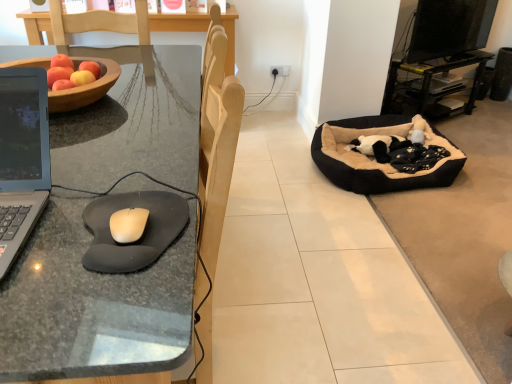
This screenshot has width=512, height=384. Describe the element at coordinates (443, 45) in the screenshot. I see `black plastic entertainment center at right` at that location.

You are a GUI agent. You are given a task and a screenshot of the screen. Output one action in this format:
    pyautogui.click(x=<x>, y=<y>)
    Task: Click on the white matte mouse at left
    
    Given the screenshot: What is the action you would take?
    pyautogui.click(x=128, y=224)

What do you see at coordinates (142, 234) in the screenshot? Image resolution: width=512 pixels, height=384 pixels. I see `black foam mousepad at left` at bounding box center [142, 234].

Where is `black foam mousepad at left`? The width and height of the screenshot is (512, 384). black foam mousepad at left is located at coordinates (142, 234).

This screenshot has width=512, height=384. Describe the element at coordinates (22, 157) in the screenshot. I see `silver metallic laptop at left` at that location.

Find the location of a particular element. Image resolution: width=512 pixels, height=384 pixels. black plastic entertainment center at right is located at coordinates (443, 45).

From a real-world perspective, between black foam mousepad at left and black glossy tv at upper right, who is vertically lower?

From a 3D spatial view, black glossy tv at upper right is below.

Is black foam mousepad at left not close to black glossy tv at upper right?

Absolutely, black foam mousepad at left is distant from black glossy tv at upper right.

Does black foam mousepad at left have a larger size compared to black glossy tv at upper right?

No, black foam mousepad at left is not bigger than black glossy tv at upper right.

How far apart are black foam mousepad at left and black glossy tv at upper right?

black foam mousepad at left and black glossy tv at upper right are 3.15 meters apart from each other.

From the image's perspective, relative to black fabric speaker at upper right, is wooden bowl at left above or below?

Clearly, from the image's perspective, wooden bowl at left is below black fabric speaker at upper right.

Which object is wider, wooden bowl at left or black fabric speaker at upper right?

With larger width is wooden bowl at left.

Image resolution: width=512 pixels, height=384 pixels. There is a black fabric speaker at upper right. In order to click on bowl above it (from a real-world perspective) in this screenshot , I will do `click(85, 87)`.

Does wooden bowl at left have a larger size compared to black fabric speaker at upper right?

Yes, wooden bowl at left is bigger than black fabric speaker at upper right.

Is black glossy tv at upper right not within black foam mousepad at left?

Yes.

From the image's perspective, between black glossy tv at upper right and black foam mousepad at left, which one is located above?

black glossy tv at upper right is shown above in the image.

Is black glossy tv at upper right beside black foam mousepad at left?

They are not placed beside each other.

Which object is positioned more to the right, black glossy tv at upper right or black foam mousepad at left?

black glossy tv at upper right.

Which of these two, wooden bowl at left or black glossy tv at upper right, is wider?

wooden bowl at left is wider.

Would you say wooden bowl at left is a long distance from black glossy tv at upper right?

Indeed, wooden bowl at left is not near black glossy tv at upper right.

Can we say wooden bowl at left lies outside black glossy tv at upper right?

Yes, wooden bowl at left is outside of black glossy tv at upper right.

From the image's perspective, is wooden bowl at left beneath black glossy tv at upper right?

Yes.

Does black rubber mouse pad at left have a larger size compared to wooden bowl at left?

Yes, black rubber mouse pad at left is bigger than wooden bowl at left.

In terms of width, does black rubber mouse pad at left look wider or thinner when compared to wooden bowl at left?

black rubber mouse pad at left is wider than wooden bowl at left.

Considering the positions of points (142, 81) and (87, 94), is point (142, 81) farther from camera compared to point (87, 94)?

Yes, it is.

Which of these two, black foam mousepad at left or black fabric speaker at upper right, is thinner?

With smaller width is black fabric speaker at upper right.

Is black foam mousepad at left surrounding black fabric speaker at upper right?

No.

Does black foam mousepad at left appear on the right side of black fabric speaker at upper right?

In fact, black foam mousepad at left is to the left of black fabric speaker at upper right.

Considering the sizes of objects black foam mousepad at left and black fabric speaker at upper right in the image provided, who is smaller, black foam mousepad at left or black fabric speaker at upper right?

Smaller between the two is black foam mousepad at left.

Can you tell me how much wooden bowl at left and black plush dog bed at right differ in facing direction?

The facing directions of wooden bowl at left and black plush dog bed at right are 92.3 degrees apart.

From the picture: Could you tell me if wooden bowl at left is turned towards black plush dog bed at right?

No, wooden bowl at left is not facing towards black plush dog bed at right.

From a real-world perspective, does wooden bowl at left sit lower than black plush dog bed at right?

Incorrect, from a real-world perspective, wooden bowl at left is higher than black plush dog bed at right.

This screenshot has width=512, height=384. What are the coordinates of `mousepad on the left of the black glossy tv at upper right` in the screenshot? It's located at (142, 234).

Identify the location of bowl located below the black fabric speaker at upper right (from the image's perspective). This screenshot has height=384, width=512. (85, 87).

From the image, which object appears to be nearer to black rubber mouse pad at left, silver metallic laptop at left or black plush dog bed at right?

silver metallic laptop at left.

When comparing their distances from black fabric speaker at upper right, does black plush dog bed at right or black foam mousepad at left seem further?

Based on the image, black foam mousepad at left appears to be further to black fabric speaker at upper right.

Looking at the image, which one is located further to black glossy tv at upper right, black rubber mouse pad at left or black plush dog bed at right?

The object further to black glossy tv at upper right is black rubber mouse pad at left.

Based on the photo, looking at the image, which one is located closer to white matte mouse at left, black plush dog bed at right or silver metallic laptop at left?

silver metallic laptop at left is closer to white matte mouse at left.

Which object lies nearer to the anchor point black fabric speaker at upper right, black rubber mouse pad at left or black plastic entertainment center at right?

Among the two, black plastic entertainment center at right is located nearer to black fabric speaker at upper right.

Which object lies nearer to the anchor point black plastic entertainment center at right, black foam mousepad at left or wooden bowl at left?

Based on the image, wooden bowl at left appears to be nearer to black plastic entertainment center at right.

Considering their positions, is wooden bowl at left positioned further to black fabric speaker at upper right than black foam mousepad at left?

black foam mousepad at left is positioned further to the anchor black fabric speaker at upper right.

From the image, which object appears to be farther from black fabric speaker at upper right, black plush dog bed at right or silver metallic laptop at left?

Among the two, silver metallic laptop at left is located further to black fabric speaker at upper right.

Where is `dog bed between white matte mouse at left and black plastic entertainment center at right from front to back`? This screenshot has height=384, width=512. dog bed between white matte mouse at left and black plastic entertainment center at right from front to back is located at coordinates (373, 157).

Locate an element on the screen. bowl positioned between silver metallic laptop at left and black plastic entertainment center at right from near to far is located at coordinates (85, 87).

Where is `bowl between silver metallic laptop at left and black plush dog bed at right from front to back`? This screenshot has height=384, width=512. bowl between silver metallic laptop at left and black plush dog bed at right from front to back is located at coordinates (85, 87).

This screenshot has width=512, height=384. Find the location of `computer monitor between black rubber mouse pad at left and black plastic entertainment center at right from front to back`. computer monitor between black rubber mouse pad at left and black plastic entertainment center at right from front to back is located at coordinates (449, 28).